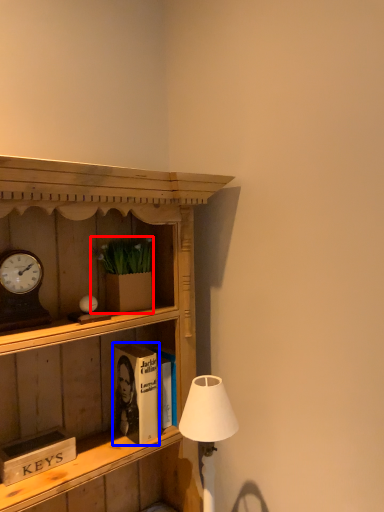
Question: Which object is further to the camera taking this photo, houseplant (highlighted by a red box) or book (highlighted by a blue box)?

Choices:
 (A) houseplant
 (B) book

Answer: (B)